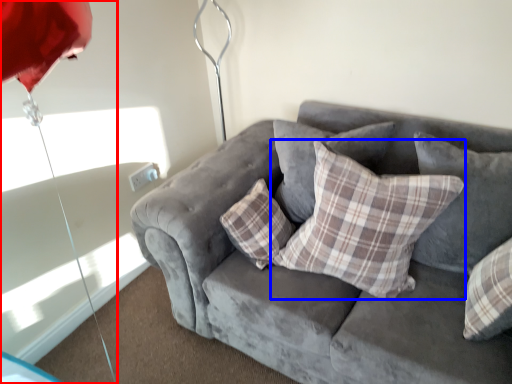
Question: Which object appears closest to the camera in this image, umbrella (highlighted by a red box) or pillow (highlighted by a blue box)?

Choices:
 (A) umbrella
 (B) pillow

Answer: (A)